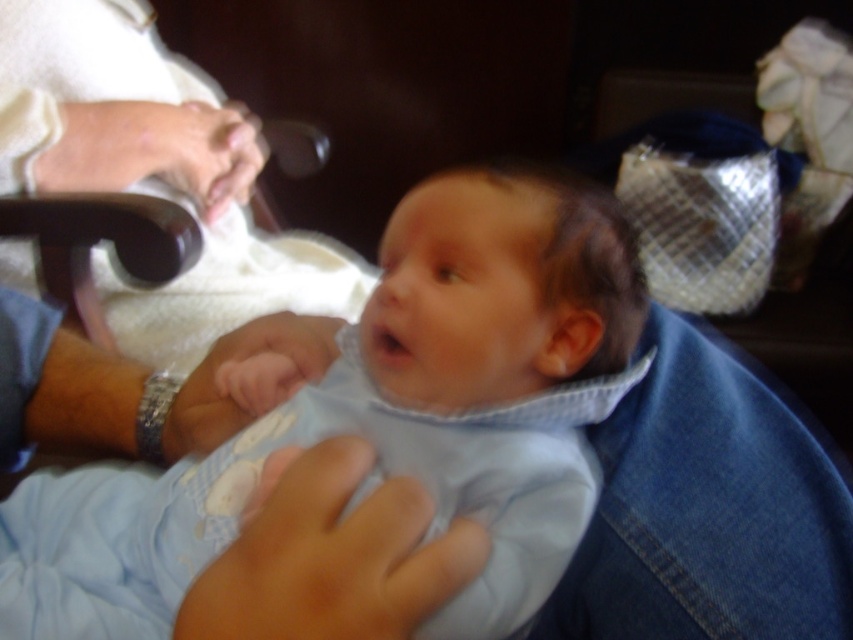
Who is shorter, metallic wristwatch at lower left or smooth skin at upper left?

With less height is metallic wristwatch at lower left.

Can you confirm if metallic wristwatch at lower left is bigger than smooth skin at upper left?

Incorrect, metallic wristwatch at lower left is not larger than smooth skin at upper left.

Is point (138, 456) positioned after point (155, 148)?

No, (138, 456) is closer to viewer.

Find the location of `metallic wristwatch at lower left`. metallic wristwatch at lower left is located at coordinates (61, 387).

Who is higher up, smooth skin hand at center or smooth skin at upper left?

smooth skin at upper left

Between smooth skin hand at center and smooth skin at upper left, which one appears on the left side from the viewer's perspective?

From the viewer's perspective, smooth skin at upper left appears more on the left side.

This screenshot has width=853, height=640. Find the location of `smooth skin hand at center`. smooth skin hand at center is located at coordinates (329, 556).

Between light blue quilted fabric at center and smooth skin at upper left, which one appears on the right side from the viewer's perspective?

From the viewer's perspective, light blue quilted fabric at center appears more on the right side.

From the picture: Is light blue quilted fabric at center to the right of smooth skin at upper left from the viewer's perspective?

Yes, light blue quilted fabric at center is to the right of smooth skin at upper left.

Where is `light blue quilted fabric at center`? This screenshot has height=640, width=853. light blue quilted fabric at center is located at coordinates (386, 419).